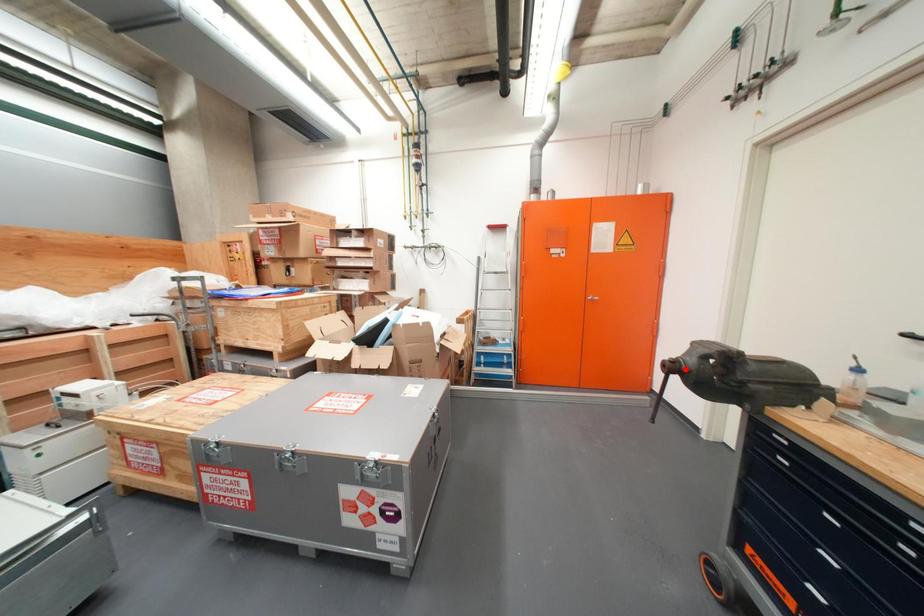
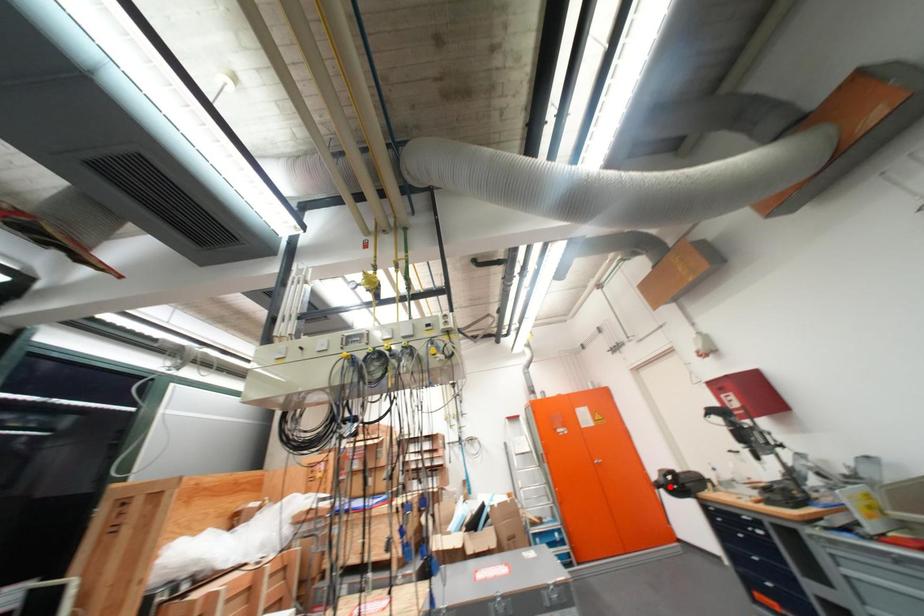
I am providing you with two images of the same scene from different viewpoints. A red point is marked on the first image and another point is marked on the second image. Do the highlighted points in image1 and image2 indicate the same real-world spot?

Yes